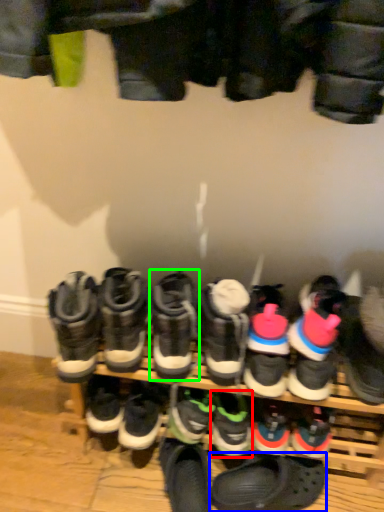
Question: Which object is positioned closest to footwear (highlighted by a red box)? Select from footwear (highlighted by a blue box) and footwear (highlighted by a green box).

Choices:
 (A) footwear
 (B) footwear

Answer: (A)